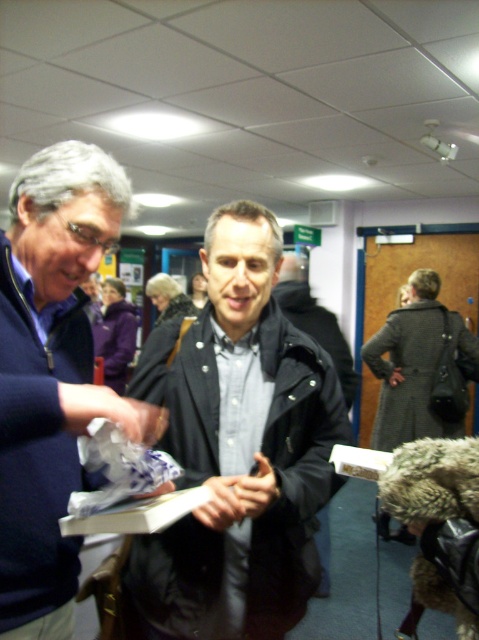
Between blue sweater at left and dark gray fabric coat at center, which one has less height?

Standing shorter between the two is dark gray fabric coat at center.

What do you see at coordinates (53, 374) in the screenshot?
I see `blue sweater at left` at bounding box center [53, 374].

The image size is (479, 640). I want to click on blue sweater at left, so click(x=53, y=374).

Does point (179, 612) come behind point (274, 288)?

No.

Is matte black jacket at center thinner than dark gray fabric coat at center?

In fact, matte black jacket at center might be wider than dark gray fabric coat at center.

Does point (226, 556) come behind point (341, 342)?

No, (226, 556) is in front of (341, 342).

This screenshot has height=640, width=479. Identify the location of matte black jacket at center. pyautogui.click(x=238, y=448).

Is matte black jacket at center closer to camera compared to blue sweater at left?

No, matte black jacket at center is behind blue sweater at left.

Consider the image. Does matte black jacket at center have a greater width compared to blue sweater at left?

Correct, the width of matte black jacket at center exceeds that of blue sweater at left.

What do you see at coordinates (238, 448) in the screenshot?
I see `matte black jacket at center` at bounding box center [238, 448].

Image resolution: width=479 pixels, height=640 pixels. What are the coordinates of `matte black jacket at center` in the screenshot? It's located at (238, 448).